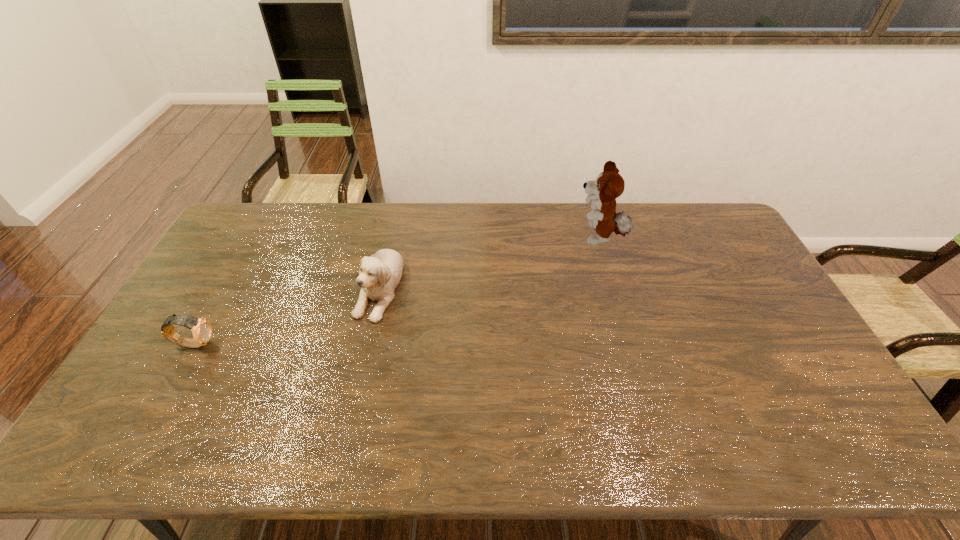
Locate an element on the screen. free space that satisfies the following two spatial constraints: 1. on the front-facing side of the second object from right to left; 2. on the face of the leftmost object is located at coordinates (366, 343).